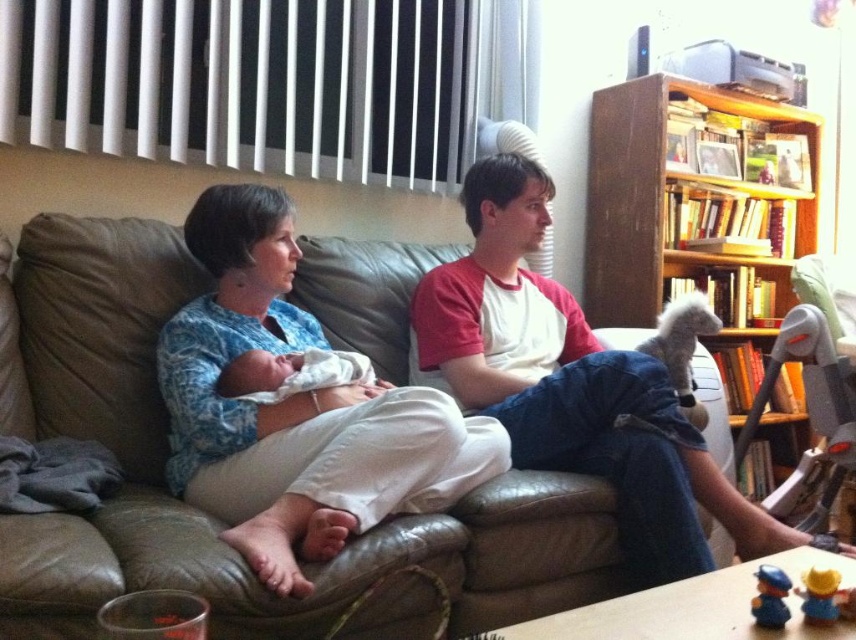
Question: Which point appears farthest from the camera in this image?

Choices:
 (A) (759, 602)
 (B) (236, 356)
 (C) (853, 436)
 (D) (265, 570)

Answer: (C)

Question: Does gray plastic robot at right appear on the right side of smooth plastic toy at lower right?

Choices:
 (A) no
 (B) yes

Answer: (B)

Question: Can you confirm if matte white shirt at center is positioned above blue printed fabric at center?

Choices:
 (A) no
 (B) yes

Answer: (A)

Question: Estimate the real-world distances between objects in this image. Which object is closer to the white soft baby at center?

Choices:
 (A) wooden bookshelf at upper right
 (B) smooth plastic toy at lower right
 (C) matte white shirt at center

Answer: (C)

Question: Which point is closer to the camera?

Choices:
 (A) (361, 356)
 (B) (241, 204)
 (C) (801, 588)
 (D) (218, 348)

Answer: (C)

Question: Where is yellow matte toy at lower right located in relation to smooth plastic toy at lower right in the image?

Choices:
 (A) below
 (B) above

Answer: (A)